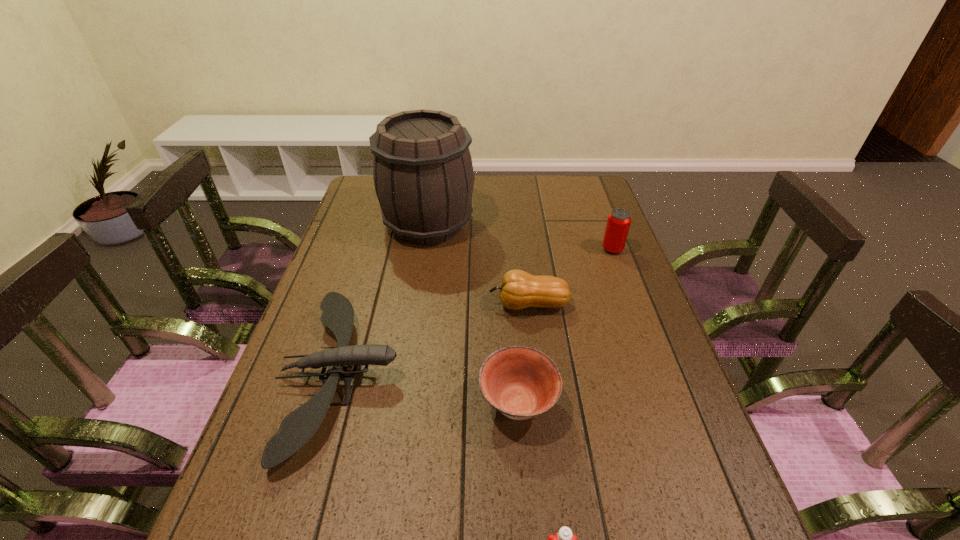
In the image, there is a desktop. Where is `vacant region at the right edge`? vacant region at the right edge is located at coordinates (612, 211).

Locate an element on the screen. The width and height of the screenshot is (960, 540). free space between the rightmost object and the gourd is located at coordinates (570, 277).

The image size is (960, 540). What are the coordinates of `vacant point located between the bowl and the rightmost object` in the screenshot? It's located at (565, 326).

Where is `vacant point located between the gourd and the drone`? vacant point located between the gourd and the drone is located at coordinates (435, 340).

You are a GUI agent. You are given a task and a screenshot of the screen. Output one action in this format:
    pyautogui.click(x=<x>, y=<y>)
    Task: Click on the free space between the bowl and the fifth shortest object
    This screenshot has width=960, height=540.
    Given the screenshot: What is the action you would take?
    (565, 326)

Where is `free space between the tallest object and the drone`? The image size is (960, 540). free space between the tallest object and the drone is located at coordinates (385, 299).

The width and height of the screenshot is (960, 540). I want to click on blank region between the wine bucket and the drone, so click(x=385, y=299).

Point out which object is positioned as the nearest to the drone. Please provide its 2D coordinates. Your answer should be formatted as a tuple, i.e. [(x, y)], where the tuple contains the x and y coordinates of a point satisfying the conditions above.

[(520, 382)]

Identify the location of the third closest object to the nearest object. (518, 290).